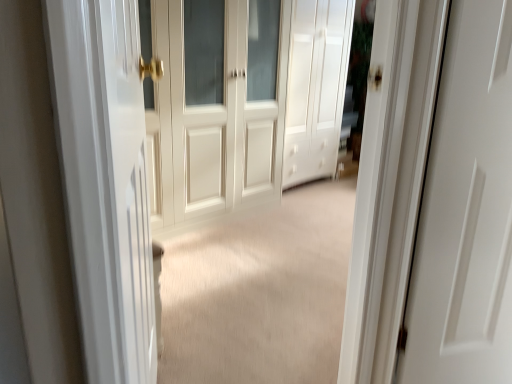
Question: From a real-world perspective, is white wood door at center, marked as the second door in a right-to-left arrangement, physically above white glossy door at left?

Choices:
 (A) no
 (B) yes

Answer: (B)

Question: Is white wood door at center, marked as the second door in a right-to-left arrangement, oriented towards white glossy door at left?

Choices:
 (A) no
 (B) yes

Answer: (A)

Question: Does white wood door at center, the 1th door when ordered from left to right, have a larger size compared to white glossy door at left?

Choices:
 (A) no
 (B) yes

Answer: (B)

Question: Would you say white wood door at center, marked as the second door in a right-to-left arrangement, contains white glossy door at left?

Choices:
 (A) no
 (B) yes

Answer: (A)

Question: From the image's perspective, is white wood door at center, the 1th door when ordered from left to right, above white glossy door at left?

Choices:
 (A) no
 (B) yes

Answer: (B)

Question: Is white matte cabinet at center, which ranks as the 1th door in right-to-left order, taller or shorter than white wood door at center, the 1th door when ordered from left to right?

Choices:
 (A) short
 (B) tall

Answer: (B)

Question: Does point (316, 51) appear closer or farther from the camera than point (209, 168)?

Choices:
 (A) closer
 (B) farther

Answer: (B)

Question: Looking at their shapes, would you say white matte cabinet at center, which ranks as the 1th door in right-to-left order, is wider or thinner than white wood door at center, marked as the second door in a right-to-left arrangement?

Choices:
 (A) wide
 (B) thin

Answer: (B)

Question: Choose the correct answer: Is white matte cabinet at center, acting as the second door starting from the left, inside white wood door at center, marked as the second door in a right-to-left arrangement, or outside it?

Choices:
 (A) inside
 (B) outside

Answer: (B)

Question: In the image, is white glossy door at left on the left side or the right side of white wood door at center, marked as the second door in a right-to-left arrangement?

Choices:
 (A) left
 (B) right

Answer: (B)

Question: In terms of height, does white glossy door at left look taller or shorter compared to white wood door at center, marked as the second door in a right-to-left arrangement?

Choices:
 (A) short
 (B) tall

Answer: (A)

Question: Does point (79, 79) appear closer or farther from the camera than point (180, 66)?

Choices:
 (A) farther
 (B) closer

Answer: (B)

Question: From a real-world perspective, is white glossy door at left above or below white wood door at center, the 1th door when ordered from left to right?

Choices:
 (A) below
 (B) above

Answer: (A)

Question: In the image, is white matte cabinet at center, which ranks as the 1th door in right-to-left order, on the left side or the right side of white glossy door at left?

Choices:
 (A) left
 (B) right

Answer: (B)

Question: Considering the positions of white matte cabinet at center, acting as the second door starting from the left, and white glossy door at left in the image, is white matte cabinet at center, acting as the second door starting from the left, taller or shorter than white glossy door at left?

Choices:
 (A) short
 (B) tall

Answer: (B)